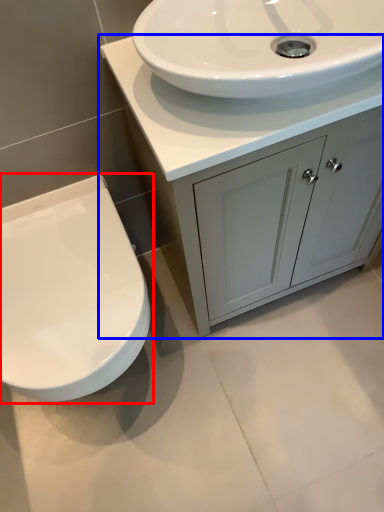
Question: Among these objects, which one is farthest to the camera, toilet (highlighted by a red box) or bathroom cabinet (highlighted by a blue box)?

Choices:
 (A) toilet
 (B) bathroom cabinet

Answer: (A)